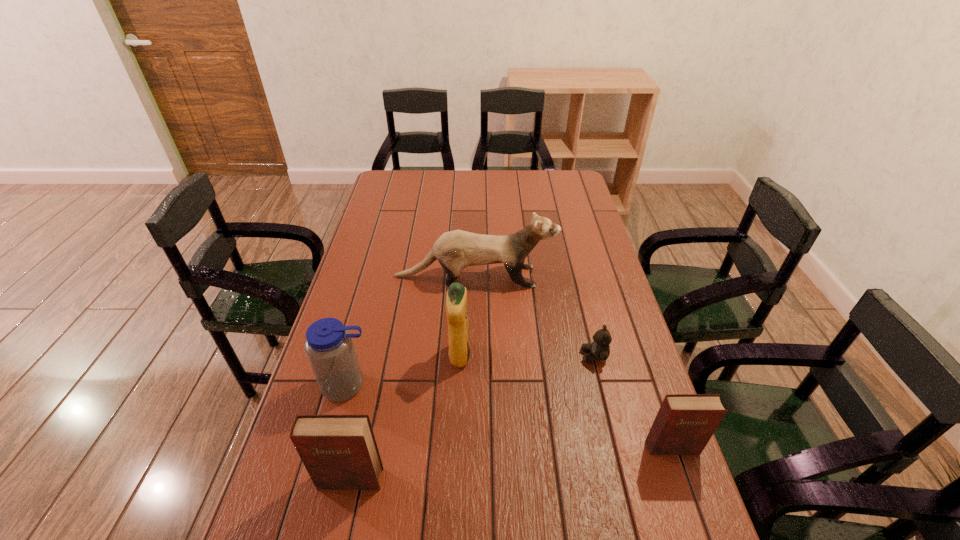
At what (x,y) coordinates should I click in order to perform the action: click on vacant space located 0.140m on the front cover of the farther diary. Please return your answer as a coordinate pair (x, y). Image resolution: width=960 pixels, height=540 pixels. Looking at the image, I should click on (696, 518).

Identify the location of free location located with a carrying loop on the side of the water bottle. (335, 432).

The width and height of the screenshot is (960, 540). Identify the location of vacant space located 0.130m on the face of the farthest object. (592, 276).

This screenshot has width=960, height=540. Identify the location of blank space located on the label of the detergent. (519, 356).

This screenshot has height=540, width=960. Identify the location of vacant space located on the face of the teddy bear. (494, 356).

Locate an element on the screen. blank area located on the face of the teddy bear is located at coordinates (518, 356).

Locate an element on the screen. Image resolution: width=960 pixels, height=540 pixels. free space located on the face of the teddy bear is located at coordinates (480, 356).

Where is `diary located at the left edge`? This screenshot has height=540, width=960. diary located at the left edge is located at coordinates (339, 452).

This screenshot has height=540, width=960. Identify the location of water bottle that is at the left edge. 329,346.

Locate an element on the screen. ferret positioned at the left edge is located at coordinates (455, 250).